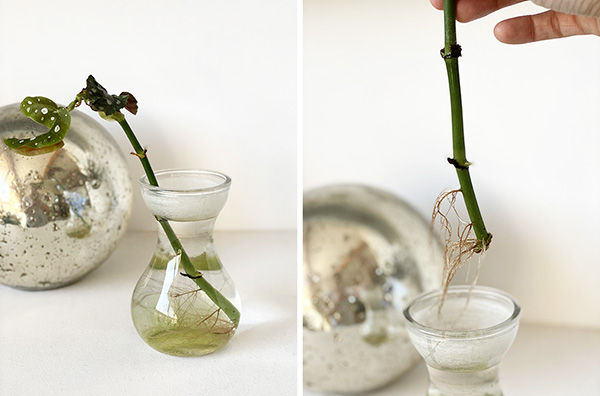
Where is `reflection of room`? reflection of room is located at coordinates coord(41,162).